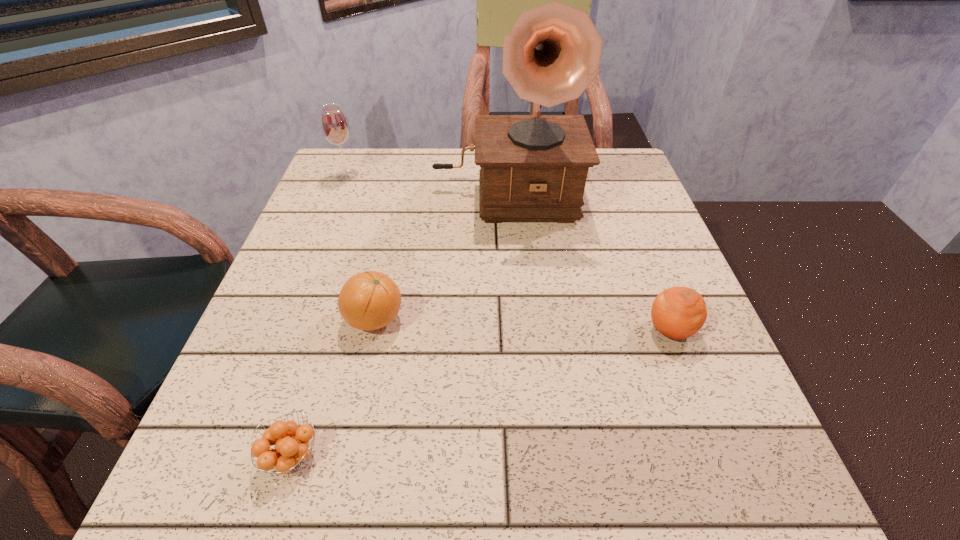
What are the coordinates of `the second object from right to left` in the screenshot? It's located at (534, 167).

Locate an element on the screen. The height and width of the screenshot is (540, 960). record player is located at coordinates (534, 167).

Identify the location of wineglass. The height and width of the screenshot is (540, 960). (334, 124).

The image size is (960, 540). What are the coordinates of `the second tallest object` in the screenshot? It's located at tap(334, 124).

You are a GUI agent. You are given a task and a screenshot of the screen. Output one action in this format:
    pyautogui.click(x=<x>, y=<y>)
    Task: Click on the rightmost orange fruit
    
    Given the screenshot: What is the action you would take?
    pyautogui.click(x=678, y=312)

Locate an element on the screen. the shortest object is located at coordinates (289, 452).

Image resolution: width=960 pixels, height=540 pixels. In order to click on the nearest object in this screenshot , I will do `click(289, 452)`.

This screenshot has width=960, height=540. In order to click on free space located 0.380m on the horn of the record player in this screenshot , I will do `click(518, 376)`.

Identify the location of vacant region located on the right of the fourth shortest object. (448, 176).

Where is `vacant point located 0.100m on the front of the rightmost object`? This screenshot has width=960, height=540. vacant point located 0.100m on the front of the rightmost object is located at coordinates (698, 403).